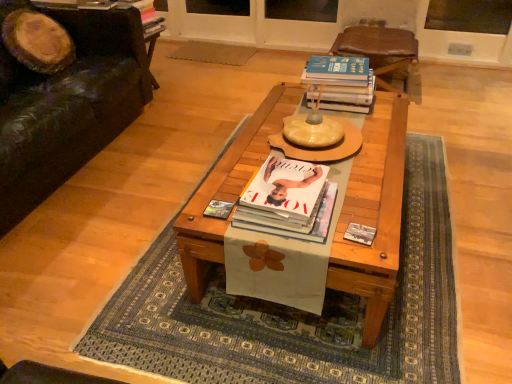
Where is `empty space that is ontop of hardcover book at upper right, the second book from the bottom (from a real-world perspective)`? empty space that is ontop of hardcover book at upper right, the second book from the bottom (from a real-world perspective) is located at coordinates (335, 68).